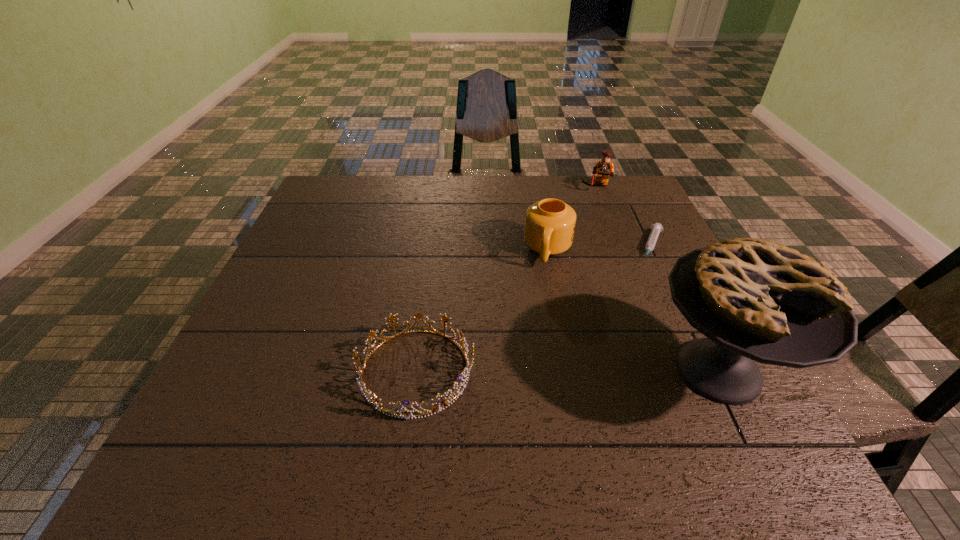
This screenshot has width=960, height=540. In order to click on unoccupied position between the mug and the tiara in this screenshot , I will do `click(482, 311)`.

The height and width of the screenshot is (540, 960). What are the coordinates of `blank region between the shortest object and the Lego` in the screenshot? It's located at (625, 217).

Find the location of a particular element. The width and height of the screenshot is (960, 540). vacant point located between the farthest object and the pie is located at coordinates (x=658, y=279).

You are a GUI agent. You are given a task and a screenshot of the screen. Output one action in this format:
    pyautogui.click(x=<x>, y=<y>)
    Task: Click on the empty space between the shortest object and the mug
    This screenshot has width=960, height=540.
    Given the screenshot: What is the action you would take?
    pyautogui.click(x=600, y=248)

Locate an element on the screen. This screenshot has width=960, height=540. free spot between the Lego and the syringe is located at coordinates (625, 217).

Find the location of a particular element. The image size is (960, 540). free point between the tallest object and the mug is located at coordinates (x=633, y=311).

Locate an element on the screen. unoccupied position between the Lego and the pie is located at coordinates (658, 279).

This screenshot has height=540, width=960. I want to click on unoccupied area between the pie and the farthest object, so click(658, 279).

At what (x,y) coordinates should I click in order to perform the action: click on object that is the third closest one to the Lego. Please return your answer as a coordinate pair (x, y). Looking at the image, I should click on (755, 300).

Locate which object ranks fourth in proximity to the Lego. Please provide its 2D coordinates. Your answer should be formatted as a tuple, i.e. [(x, y)], where the tuple contains the x and y coordinates of a point satisfying the conditions above.

[(374, 400)]